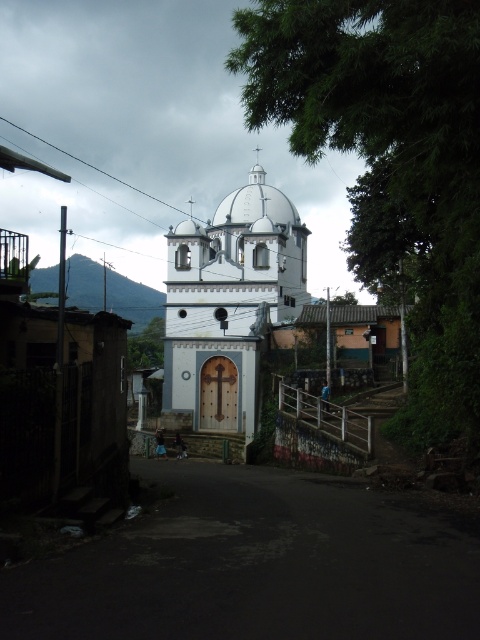
You are standing at the entrance of the church and want to reach the dark asphalt road at center. Which direction should you walk to reach it?

The dark asphalt road at center is located at point 0.884 on the x and 0.535 on the y coordinate, so you should walk towards the center of the image to reach it.

You are a delivery driver approaching the church and need to park your truck which is 3 meters tall. The road has a height restriction sign that you can not see. Based on the scene description, can you determine if your truck will fit under the white smooth church at center when driving along the dark asphalt road at center?

The dark asphalt road at center is not as tall as the white smooth church at center, so the road is shorter in height. Since the truck is 3 meters tall, and the road is not as tall as the church, but we don not know the exact height of the road, it is uncertain if the truck will fit. However, since the road is part of the scene leading to the church, it is likely the road allows vehicles, so the truck should fit.